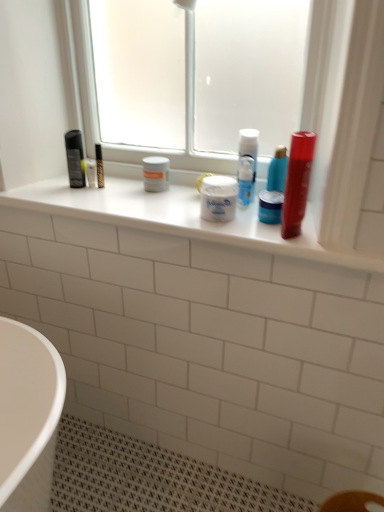
This screenshot has height=512, width=384. I want to click on free space that is to the left of white matte jar at center, so click(x=164, y=207).